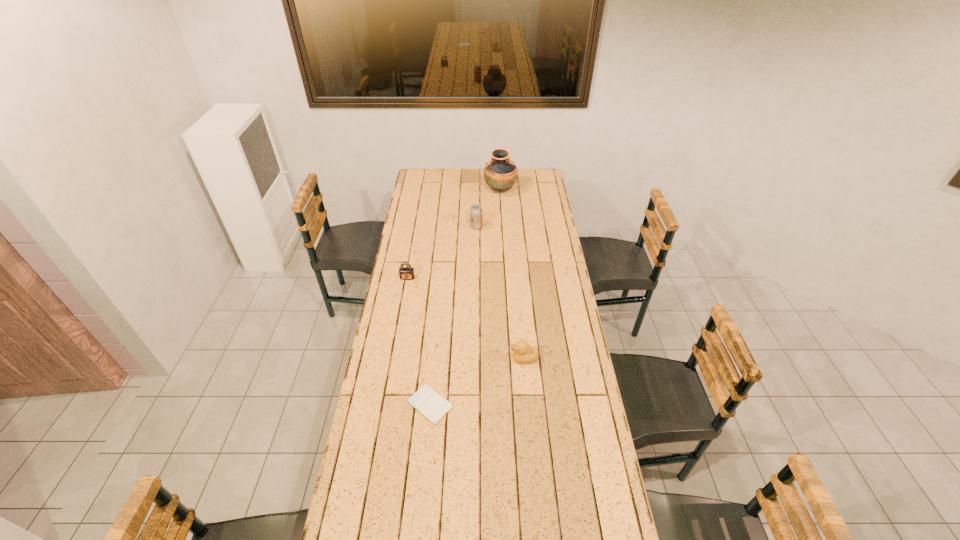
I want to click on vacant region located 0.200m on the left of the fourth nearest object, so click(x=433, y=227).

At what (x,y) coordinates should I click in order to perform the action: click on vacant space situated facing forward on the fourth farthest object. Please return your answer as a coordinate pair (x, y). This screenshot has height=540, width=960. Looking at the image, I should click on (468, 359).

Identify the location of free space located 0.300m facing forward on the fourth farthest object. Image resolution: width=960 pixels, height=540 pixels. (433, 359).

Where is `vacant region located 0.330m facing forward on the fourth farthest object`? This screenshot has height=540, width=960. vacant region located 0.330m facing forward on the fourth farthest object is located at coordinates pos(425,359).

Identify the location of blank space located on the front of the padlock near the keyhole. This screenshot has width=960, height=540. (398, 328).

Locate an element on the screen. This screenshot has width=960, height=540. free space located on the front of the shortest object is located at coordinates (418, 537).

In order to click on object present at the far edge in this screenshot , I will do `click(500, 174)`.

At what (x,y) coordinates should I click in order to perform the action: click on padlock located in the left edge section of the desktop. Please return your answer as a coordinate pair (x, y). Image resolution: width=960 pixels, height=540 pixels. Looking at the image, I should click on (406, 273).

You are a GUI agent. You are given a task and a screenshot of the screen. Output one action in this format:
    pyautogui.click(x=<x>, y=<y>)
    Task: Click on the calculator at the left edge
    The width and height of the screenshot is (960, 540).
    Given the screenshot: What is the action you would take?
    pyautogui.click(x=433, y=406)

At what (x,y) coordinates should I click in order to perform the action: click on free space at the far edge. Please return your answer as a coordinate pair (x, y). The width and height of the screenshot is (960, 540). Looking at the image, I should click on (489, 188).